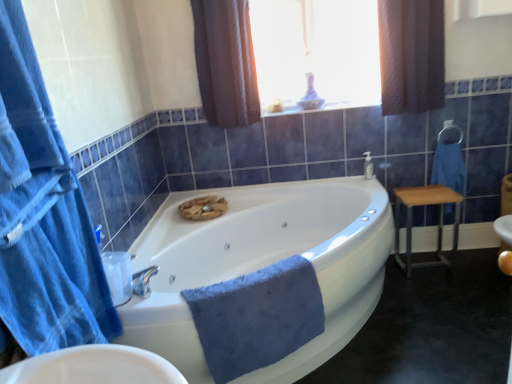
Question: From the image's perspective, is brown textured curtain at upper center, which is the third curtain from front to back, below silver metallic faucet at upper right?

Choices:
 (A) no
 (B) yes

Answer: (A)

Question: Is brown textured curtain at upper center, which ranks as the 1th curtain in back-to-front order, positioned before silver metallic faucet at upper right?

Choices:
 (A) no
 (B) yes

Answer: (B)

Question: Does brown textured curtain at upper center, which is counted as the second curtain, starting from the left, have a lesser height compared to silver metallic faucet at upper right?

Choices:
 (A) yes
 (B) no

Answer: (B)

Question: Is brown textured curtain at upper center, which is the third curtain from front to back, wider than silver metallic faucet at upper right?

Choices:
 (A) yes
 (B) no

Answer: (A)

Question: Is brown textured curtain at upper center, which appears as the 2th curtain when viewed from the right, oriented away from silver metallic faucet at upper right?

Choices:
 (A) no
 (B) yes

Answer: (A)

Question: From a real-world perspective, does brown textured curtain at upper center, which appears as the 2th curtain when viewed from the right, stand above silver metallic faucet at upper right?

Choices:
 (A) no
 (B) yes

Answer: (B)

Question: Is brown textured curtain at upper center, which appears as the 2th curtain when viewed from the right, closer to the viewer compared to translucent glass vase at upper center?

Choices:
 (A) no
 (B) yes

Answer: (B)

Question: Does brown textured curtain at upper center, which ranks as the 1th curtain in back-to-front order, have a larger size compared to translucent glass vase at upper center?

Choices:
 (A) yes
 (B) no

Answer: (A)

Question: Is the depth of brown textured curtain at upper center, which is the third curtain from front to back, greater than that of translucent glass vase at upper center?

Choices:
 (A) no
 (B) yes

Answer: (A)

Question: Is brown textured curtain at upper center, which appears as the 2th curtain when viewed from the right, directly adjacent to translucent glass vase at upper center?

Choices:
 (A) yes
 (B) no

Answer: (B)

Question: From a real-world perspective, is brown textured curtain at upper center, which is counted as the second curtain, starting from the left, below translucent glass vase at upper center?

Choices:
 (A) no
 (B) yes

Answer: (B)

Question: Does brown textured curtain at upper center, which is the third curtain from front to back, have a smaller size compared to translucent glass vase at upper center?

Choices:
 (A) yes
 (B) no

Answer: (B)

Question: Is white glossy bathtub at center turned away from wooden/metallic stool at right?

Choices:
 (A) yes
 (B) no

Answer: (B)